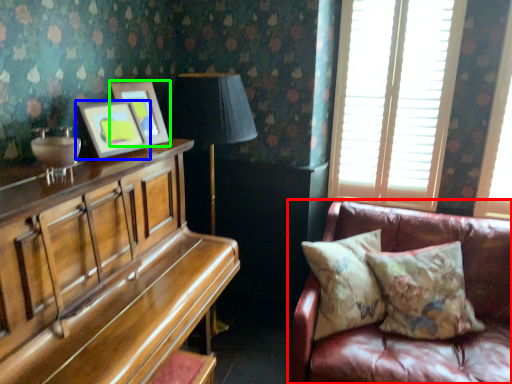
Question: Based on their relative distances, which object is nearer to studio couch (highlighted by a red box)? Choose from picture frame (highlighted by a blue box) and picture frame (highlighted by a green box).

Choices:
 (A) picture frame
 (B) picture frame

Answer: (B)